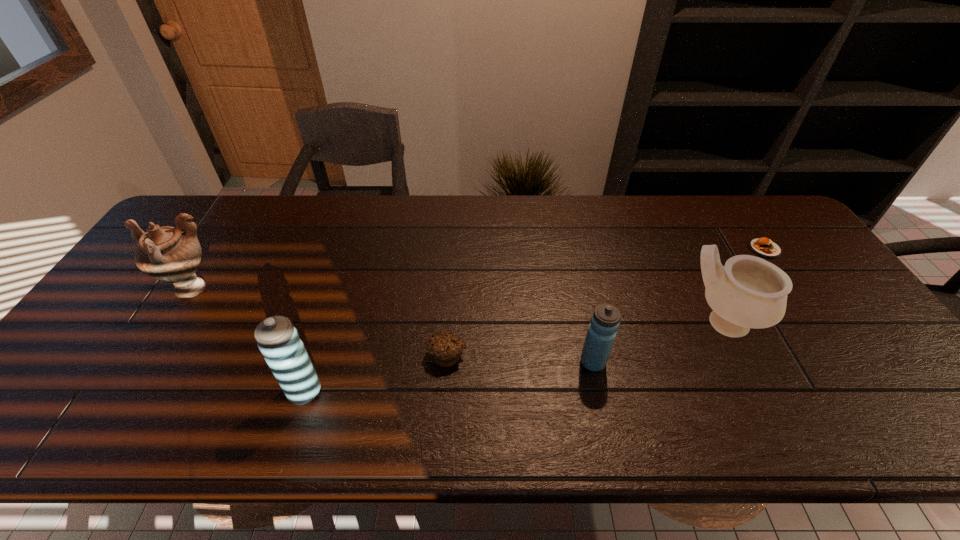
You are a GUI agent. You are given a task and a screenshot of the screen. Output one action in this format:
    pyautogui.click(x=<x>, y=<y>)
    Task: Click on the taller water bottle
    Image resolution: width=960 pixels, height=540 pixels.
    Given the screenshot: What is the action you would take?
    pyautogui.click(x=278, y=340)

Find the location of a particular element. Image resolution: width=960 pixels, height=540 pixels. the left water bottle is located at coordinates (278, 340).

This screenshot has height=540, width=960. In order to click on the third object from right to left in this screenshot , I will do `click(605, 321)`.

Identify the location of the farther water bottle. (605, 321).

Where is `the farthest object`? the farthest object is located at coordinates (764, 247).

Identify the location of the shortest object. The width and height of the screenshot is (960, 540). (764, 247).

Where is `urn`? urn is located at coordinates (165, 253).

You are a GUI agent. You are given a task and a screenshot of the screen. Output one action in this format:
    pyautogui.click(x=<x>, y=<y>)
    Task: Click on the third object from left to right
    The image size is (960, 540).
    Given the screenshot: What is the action you would take?
    pyautogui.click(x=445, y=347)

The width and height of the screenshot is (960, 540). Identify the location of muffin. (445, 347).

This screenshot has width=960, height=540. What are the coordinates of `the fifth object from left to right` in the screenshot? It's located at (748, 292).